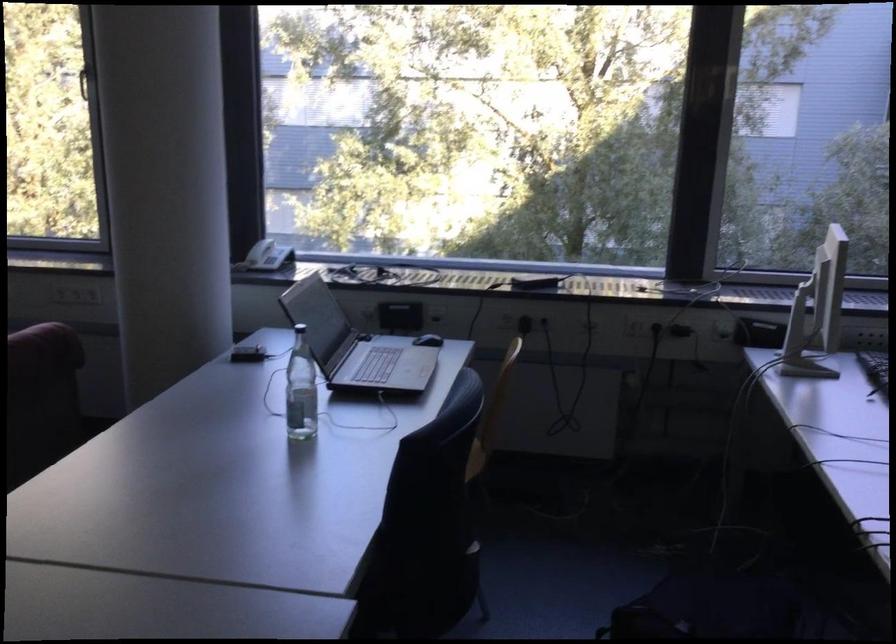
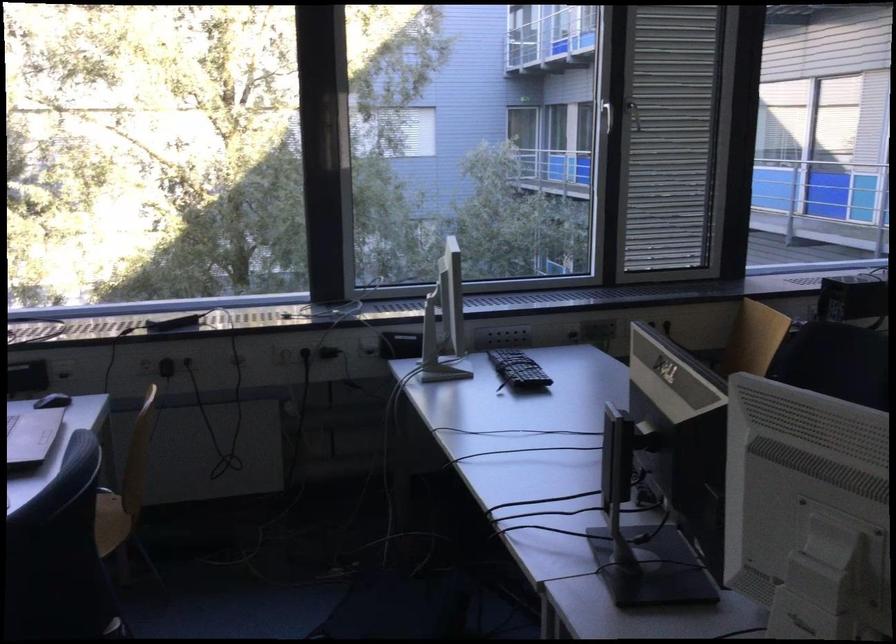
Find the pixel in the second image that matches point (634, 325) in the first image.

(285, 354)